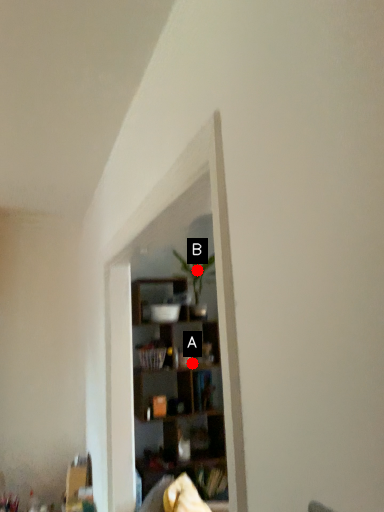
Question: Two points are circled on the image, labeled by A and B beside each circle. Which point is closer to the camera taking this photo?

Choices:
 (A) A is closer
 (B) B is closer

Answer: (A)